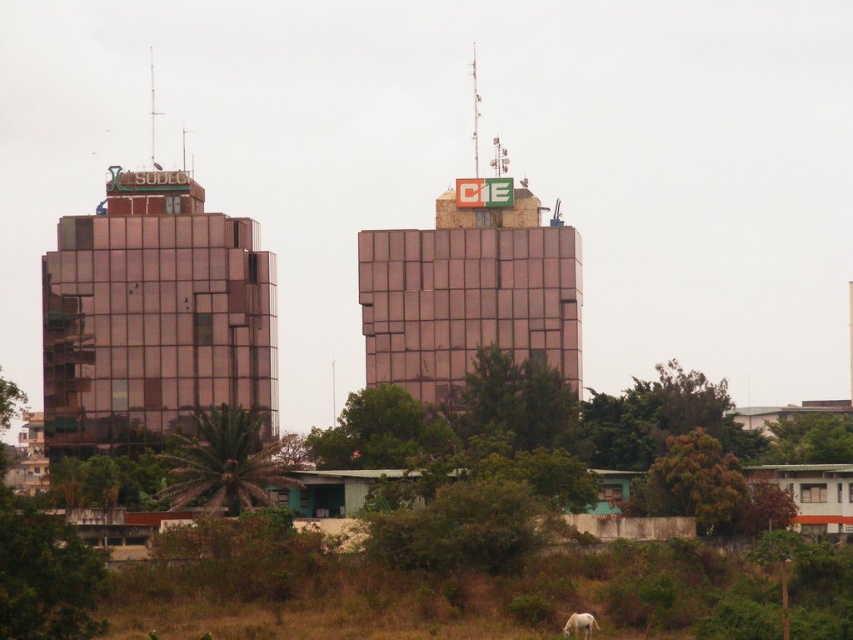
You are standing in front of the two buildings and want to take a photo of the white matte horse at lower right without the metallic glass building at center blocking it. How should you adjust your position?

The metallic glass building at center is positioned over the white matte horse at lower right, so to avoid the building blocking the horse, you should move to the left side of the scene where the building is not obstructing the horse.

Based on the photo, you are standing at the origin point in the image. Which direction should you move to reach the matte glass building at left?

The matte glass building at left is located at point 0.497 on the x axis and 0.181 on the y axis. Since you are at the origin, you should move towards the right and slightly downward to reach it.